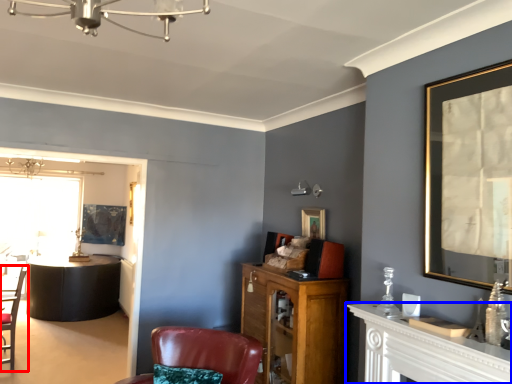
Question: Which object is closer to the camera taking this photo, chair (highlighted by a red box) or table (highlighted by a blue box)?

Choices:
 (A) chair
 (B) table

Answer: (B)